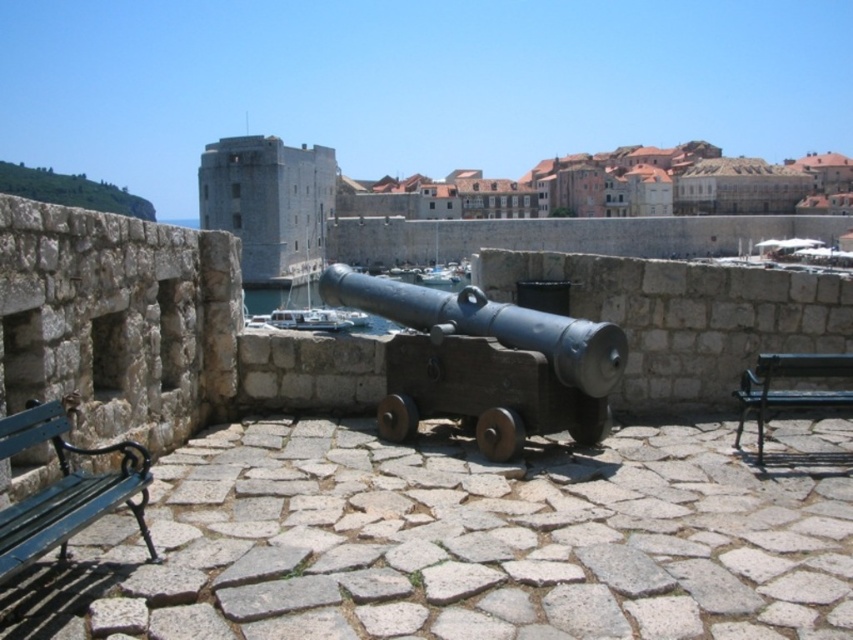
Question: Is smooth stone cannon at center bigger than green wooden bench at lower left?

Choices:
 (A) yes
 (B) no

Answer: (A)

Question: Does smooth stone cannon at center appear on the right side of green metal bench at lower right?

Choices:
 (A) no
 (B) yes

Answer: (B)

Question: Which of the following is the closest to the observer?

Choices:
 (A) (601, 243)
 (B) (12, 522)

Answer: (B)

Question: Which point is closer to the camera?

Choices:
 (A) (828, 369)
 (B) (328, 182)

Answer: (A)

Question: Where is smooth stone cannon at center located in relation to matte black cannon at center in the image?

Choices:
 (A) below
 (B) above

Answer: (B)

Question: Which object is farther from the camera taking this photo?

Choices:
 (A) green wooden bench at lower left
 (B) matte black cannon at center
 (C) smooth stone cannon at center

Answer: (C)